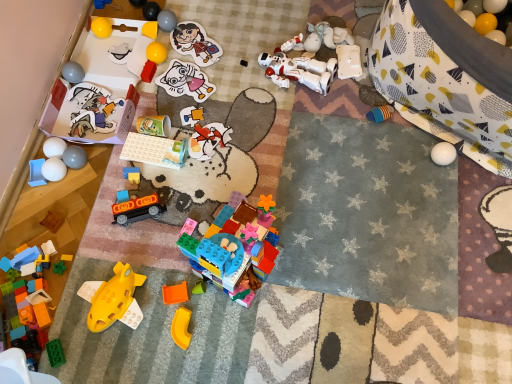
Locate an element on the screen. This screenshot has width=512, height=384. free space between white matte robot at upper center, the 3th toy viewed from the right, and orange matte train at center, placed as the 14th toy when sorted from left to right is located at coordinates (231, 133).